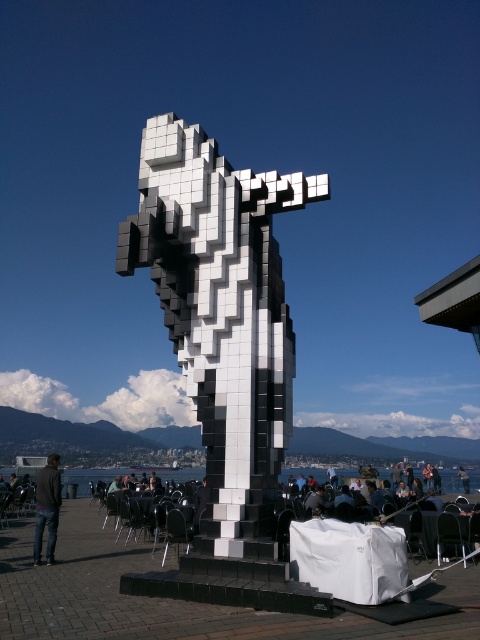
Between point (81, 477) and point (54, 524), which one is positioned behind?

The point (81, 477) is behind.

Does transparent glass water at lower center have a larger size compared to denim jacket at lower left?

Actually, transparent glass water at lower center might be smaller than denim jacket at lower left.

Is point (459, 481) closer to viewer compared to point (54, 522)?

No.

What are the coordinates of `transparent glass water at lower center` in the screenshot? It's located at (87, 477).

Is point (107, 477) in front of point (466, 481)?

No, it is behind (466, 481).

Does transparent glass water at lower center have a lesser height compared to dark gray hair at upper right?

In fact, transparent glass water at lower center may be taller than dark gray hair at upper right.

Does point (474, 472) come in front of point (466, 470)?

Yes, it is.

In order to click on transparent glass water at lower center in this screenshot , I will do `click(87, 477)`.

Between denim jacket at lower left and dark gray hair at upper right, which one is positioned higher?

denim jacket at lower left is above.

Which is more to the left, denim jacket at lower left or dark gray hair at upper right?

Positioned to the left is denim jacket at lower left.

Who is more forward, [54,456] or [468,488]?

Point [54,456] is in front.

Image resolution: width=480 pixels, height=640 pixels. In order to click on denim jacket at lower left in this screenshot , I will do `click(47, 508)`.